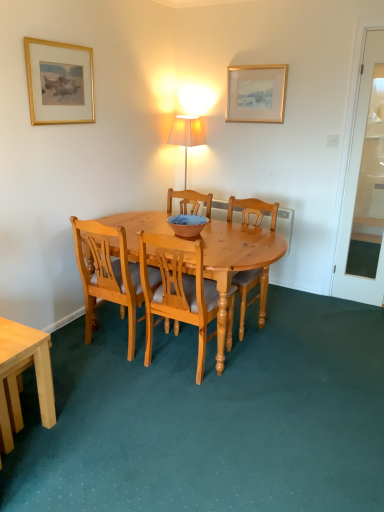
The width and height of the screenshot is (384, 512). Find the location of `vacant area that lies to the right of light brown wooden desk at lower left`. vacant area that lies to the right of light brown wooden desk at lower left is located at coordinates (82, 419).